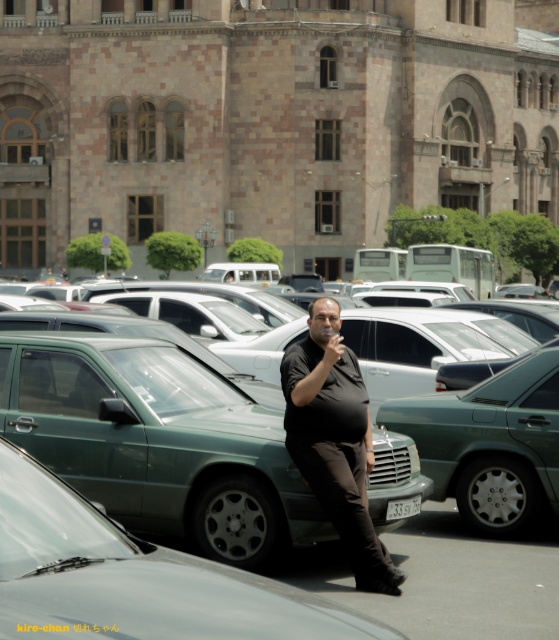
Is point (305, 477) positioned before point (40, 301)?

That is True.

From the picture: Measure the distance between black matte shirt at center and camera.

black matte shirt at center is 8.44 meters away from camera.

Is point (339, 474) more distant than point (498, 332)?

No.

Locate an element on the screen. The height and width of the screenshot is (640, 559). black matte shirt at center is located at coordinates (334, 440).